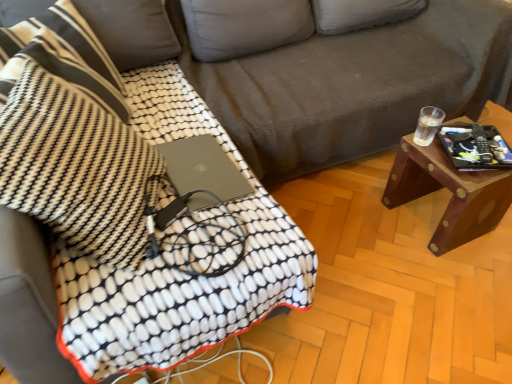
Question: From the image's perspective, is woodenmaterial/texturetable at right located above or below gray corduroy couch at center?

Choices:
 (A) above
 (B) below

Answer: (B)

Question: In the image, is woodenmaterial/texturetable at right on the left side or the right side of gray corduroy couch at center?

Choices:
 (A) left
 (B) right

Answer: (B)

Question: Estimate the real-world distances between objects in this image. Which object is closer to the white textured blanket at center?

Choices:
 (A) gray corduroy couch at center
 (B) black matte tablet at right
 (C) matte black laptop at center
 (D) woodenmaterial/texturetable at right
 (E) black textured throw pillow at upper left, which is the first throw pillow from back to front

Answer: (C)

Question: Based on their relative distances, which object is farther from the black matte tablet at right?

Choices:
 (A) black textured throw pillow at upper left, which is the first throw pillow from back to front
 (B) white textured blanket at center
 (C) black textured throw pillow at left, positioned as the 1th throw pillow in front-to-back order
 (D) matte black laptop at center
 (E) gray corduroy couch at center

Answer: (A)